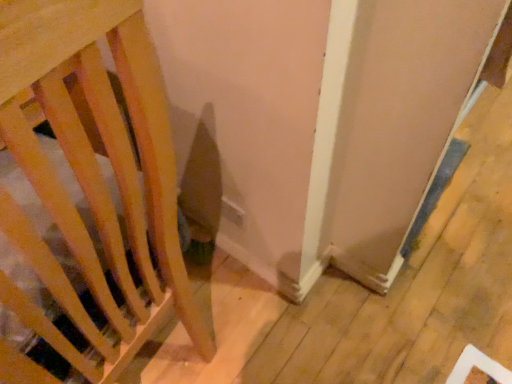
Find the location of a particular element. The width and height of the screenshot is (512, 384). wooden chair at left is located at coordinates (93, 176).

Describe the element at coordinates (93, 176) in the screenshot. The image size is (512, 384). I see `wooden chair at left` at that location.

Based on the photo, measure the distance between point (30, 245) and camera.

Point (30, 245) is 39.60 centimeters away from camera.

This screenshot has height=384, width=512. Identify the location of wooden chair at left. (93, 176).